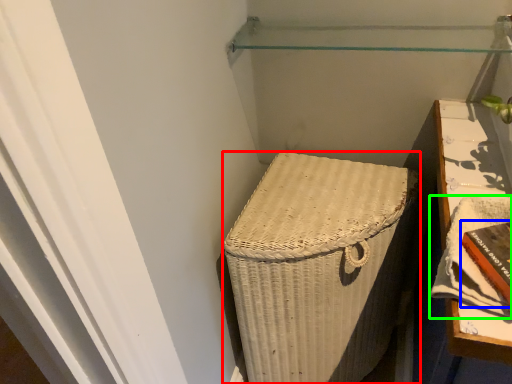
Question: Which object is positioned closest to furniture (highlighted by a red box)? Select from book (highlighted by a blue box) and book (highlighted by a green box).

Choices:
 (A) book
 (B) book

Answer: (B)